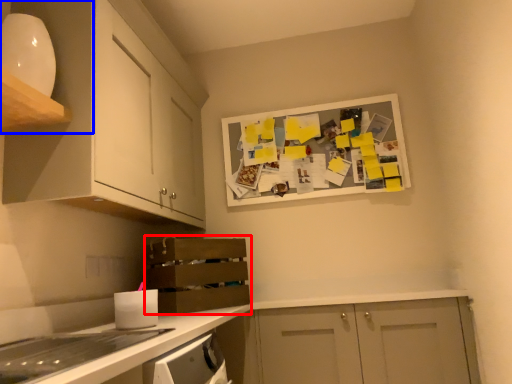
Question: Which object is closer to the camera taking this photo, shelf (highlighted by a red box) or cabinetry (highlighted by a blue box)?

Choices:
 (A) shelf
 (B) cabinetry

Answer: (B)